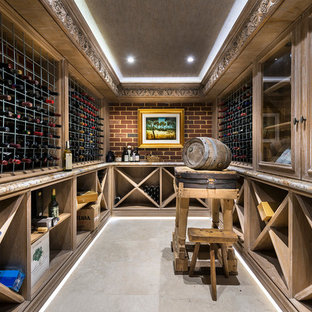
Identify the location of chair leg. (192, 263), (212, 270), (227, 263).